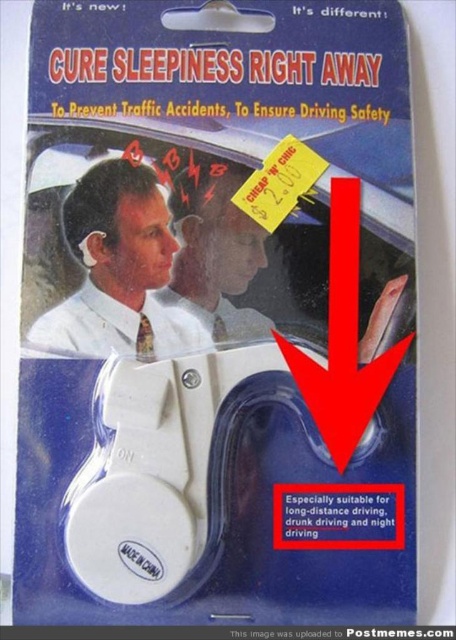
Based on the photo, you are a customer looking at the product packaging for the sleepiness cure device. The packaging has a yellow price tag labeled CHEAP N CHIC and a point marked at coordinates [119,269]. Where is this point located on the packaging?

The point at coordinates [119,269] is on the white matte tie at upper center of the packaging.

You are a customer who wants to buy the device. The packaging shows two accessories, a white matte tie at upper center and a matte white headband at upper center. Which accessory is positioned closer to you on the packaging?

The white matte tie at upper center is closer to the viewer than the matte white headband at upper center.

In the scene shown: You are a customer in a store and see the packaging for the sleepiness device. The packaging shows two accessories at the top. Which accessory is wider, the white matte tie at upper center or the matte white headband at upper center?

The white matte tie at upper center might be wider than matte white headband at upper center.